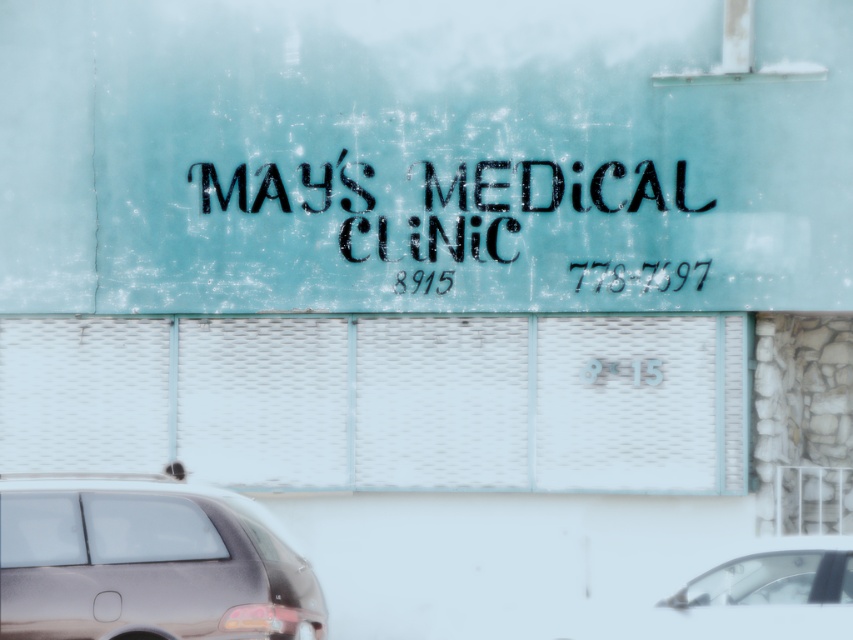
You are a delivery person trying to park your shiny metallic car at lower left. There is a metallic silver car at lower right already parked. Is there enough space to park your car without overlapping it?

The shiny metallic car at lower left is positioned over metallic silver car at lower right, meaning they are already overlapping. Therefore, there is not enough space to park the shiny metallic car at lower left without overlapping the metallic silver car at lower right.

You are a delivery driver who needs to park your shiny metallic car at lower left near the MAY S MEDICAL CLINIC. However, there is a black stenciled text at center on the ground. Can your car fit without overlapping the text?

The shiny metallic car at lower left is larger than the black stenciled text at center, so it may overlap the text if parked there. Choose another spot.